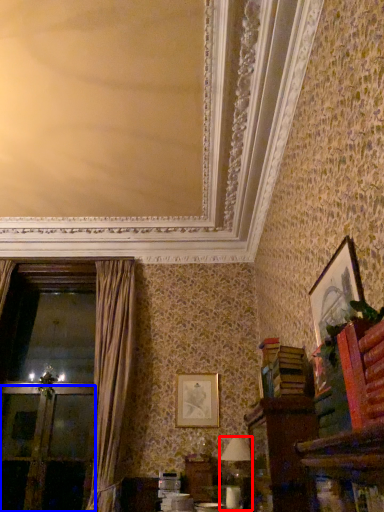
Question: Which object is further to the camera taking this photo, table lamp (highlighted by a red box) or screen door (highlighted by a blue box)?

Choices:
 (A) table lamp
 (B) screen door

Answer: (B)